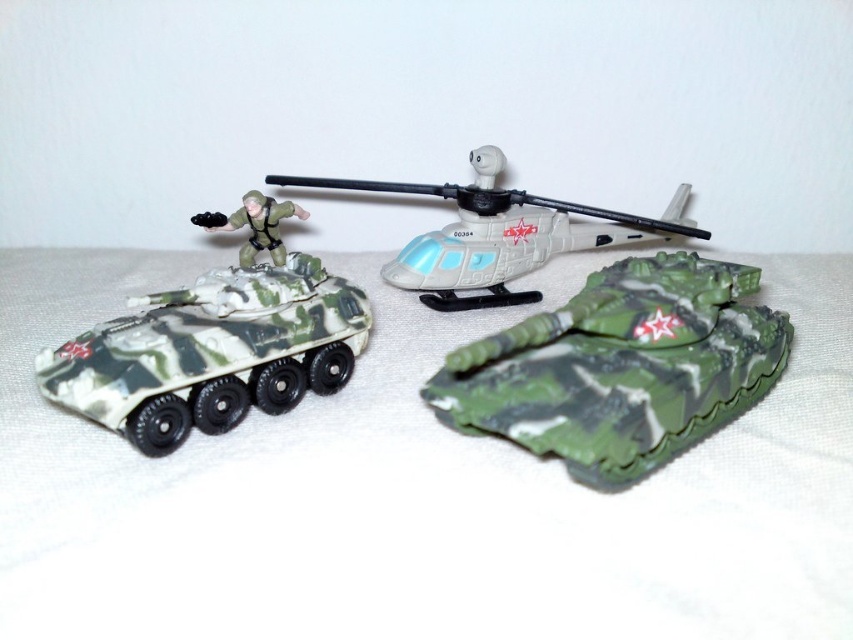
Which is below, camo plastic tank at left or matte green figure at center?

Positioned lower is camo plastic tank at left.

Between point (341, 381) and point (276, 234), which one is positioned in front?

Point (341, 381)

Is point (163, 356) farther from viewer compared to point (257, 205)?

No, it is in front of (257, 205).

This screenshot has height=640, width=853. Identify the location of camo plastic tank at left. (212, 353).

Between camouflage plastic tank at center and matte green figure at center, which one is positioned lower?

camouflage plastic tank at center is lower down.

Who is shorter, camouflage plastic tank at center or matte green figure at center?

matte green figure at center

Identify the location of camouflage plastic tank at center. (621, 368).

Identify the location of camouflage plastic tank at center. (621, 368).

Can you confirm if camouflage plastic tank at center is positioned to the right of camo plastic tank at left?

Yes, camouflage plastic tank at center is to the right of camo plastic tank at left.

Does camouflage plastic tank at center have a smaller size compared to camo plastic tank at left?

Incorrect, camouflage plastic tank at center is not smaller in size than camo plastic tank at left.

Between point (584, 452) and point (143, 436), which one is positioned behind?

Positioned behind is point (143, 436).

This screenshot has height=640, width=853. What are the coordinates of `camouflage plastic tank at center` in the screenshot? It's located at (x=621, y=368).